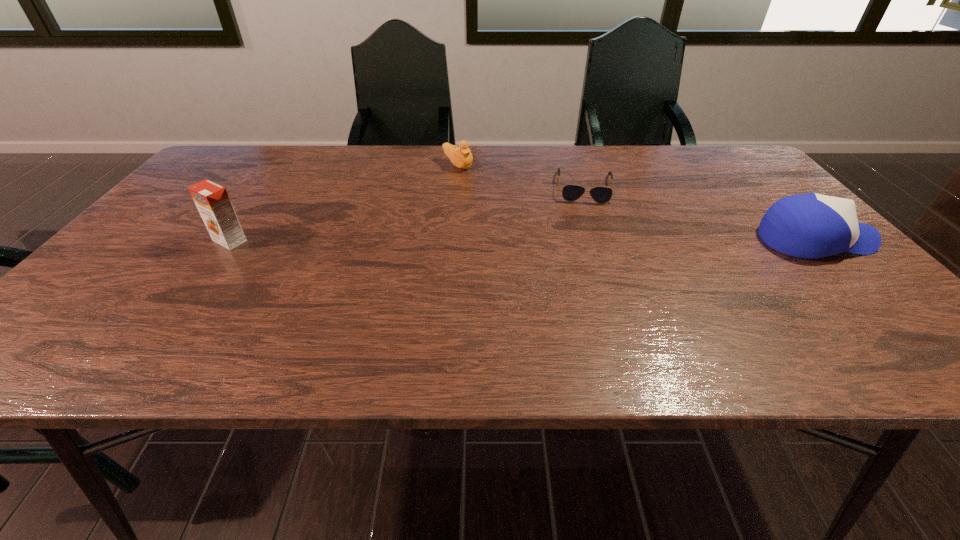
Find the location of a particular element. The image size is (960, 540). blank region between the shortest object and the orange juice is located at coordinates (407, 214).

Locate an element on the screen. vacant space in between the second object from right to left and the leftmost object is located at coordinates 407,214.

You are a GUI agent. You are given a task and a screenshot of the screen. Output one action in this format:
    pyautogui.click(x=<x>, y=<y>)
    Task: Click on the vacant space that's between the shortest object and the orange juice
    This screenshot has height=540, width=960.
    Given the screenshot: What is the action you would take?
    (x=407, y=214)

The height and width of the screenshot is (540, 960). Find the location of `object that is the third nearest to the baseball cap`. object that is the third nearest to the baseball cap is located at coordinates (212, 201).

Locate which object is the third closest to the orange juice. Please provide its 2D coordinates. Your answer should be formatted as a tuple, i.e. [(x, y)], where the tuple contains the x and y coordinates of a point satisfying the conditions above.

[(812, 225)]

Locate an element on the screen. This screenshot has height=540, width=960. vacant space that satisfies the following two spatial constraints: 1. on the front side of the second tallest object; 2. on the front-facing side of the sunglasses is located at coordinates (603, 240).

This screenshot has height=540, width=960. What are the coordinates of `vacant space that satisfies the following two spatial constraints: 1. on the back side of the leftmost object; 2. on the front-facing side of the third shortest object` in the screenshot? It's located at (230, 240).

The height and width of the screenshot is (540, 960). Identify the location of free point that satisfies the following two spatial constraints: 1. on the back side of the orange juice; 2. on the right side of the duckling. (284, 165).

In order to click on free point that satisfies the following two spatial constraints: 1. on the back side of the tallest object; 2. on the left side of the sunglasses in this screenshot , I will do `click(269, 187)`.